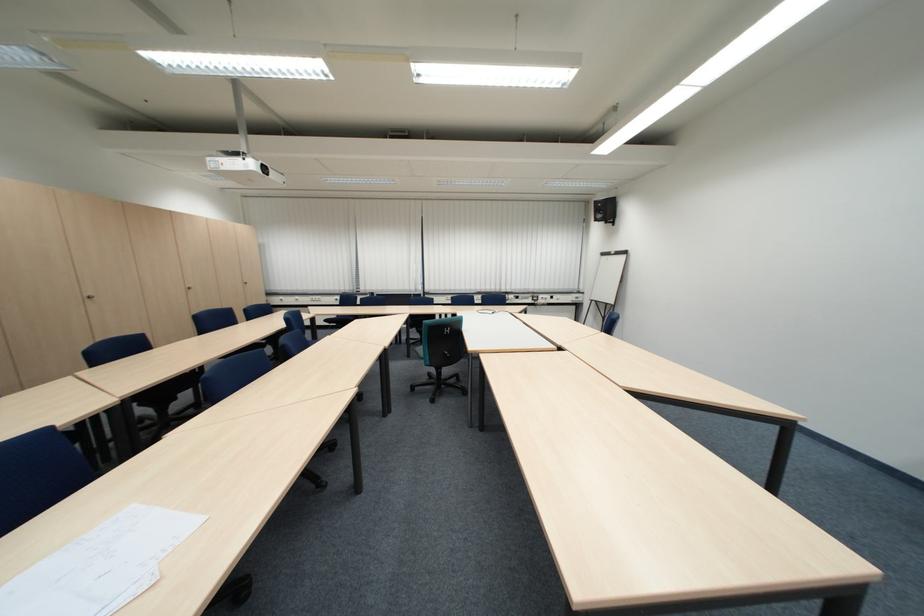
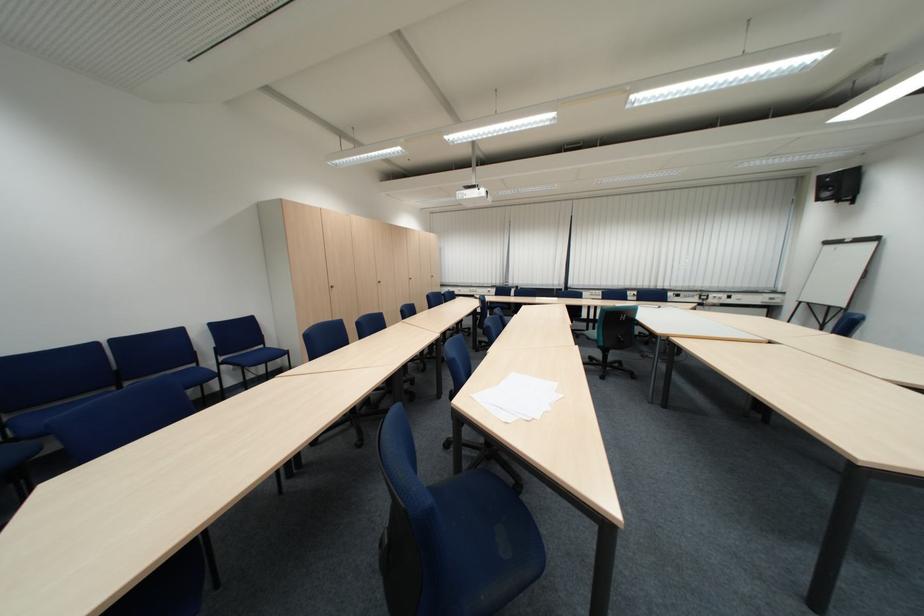
In the second image, find the point that corresponds to (x=419, y=289) in the first image.

(564, 284)